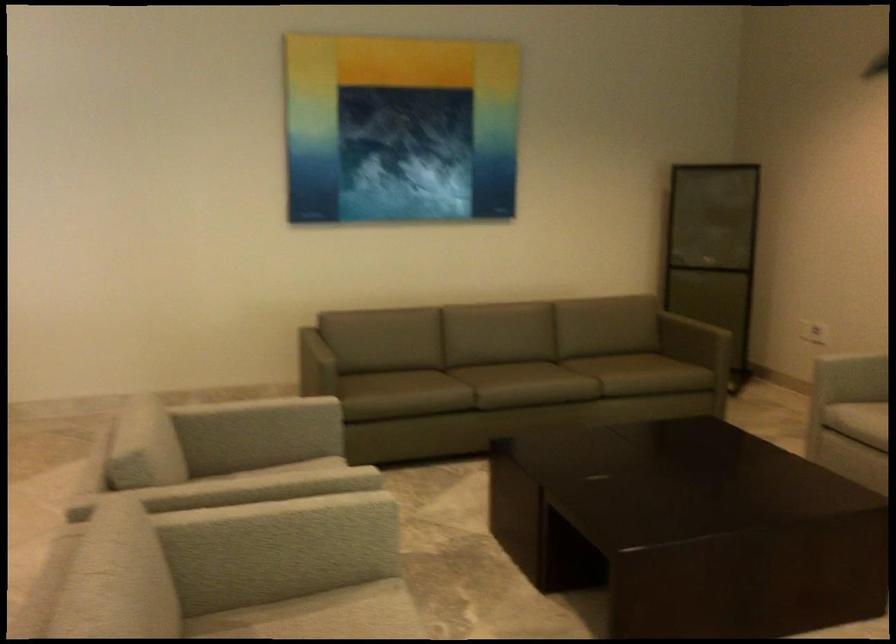
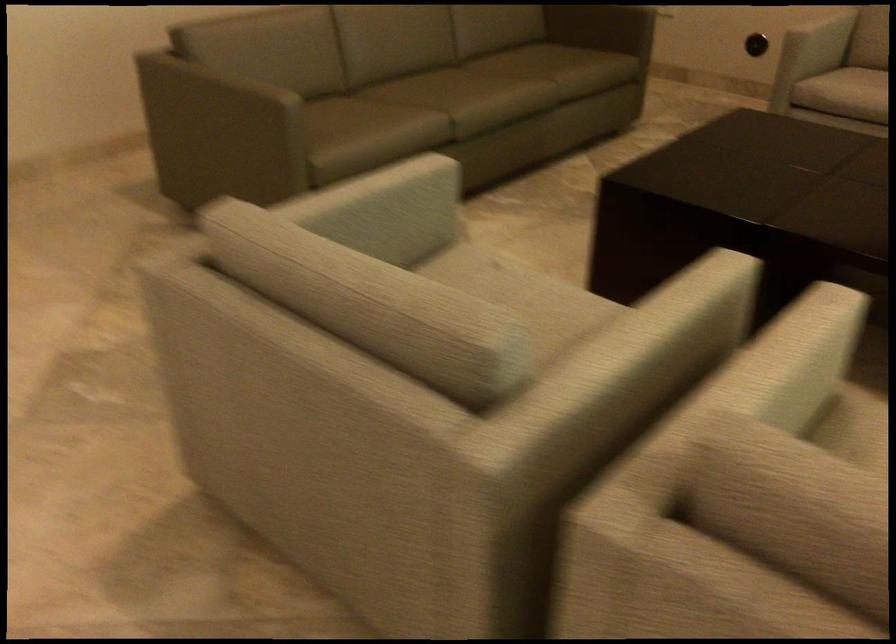
Locate, in the second image, the point that corresponds to pixel 252 420 in the first image.

(380, 210)